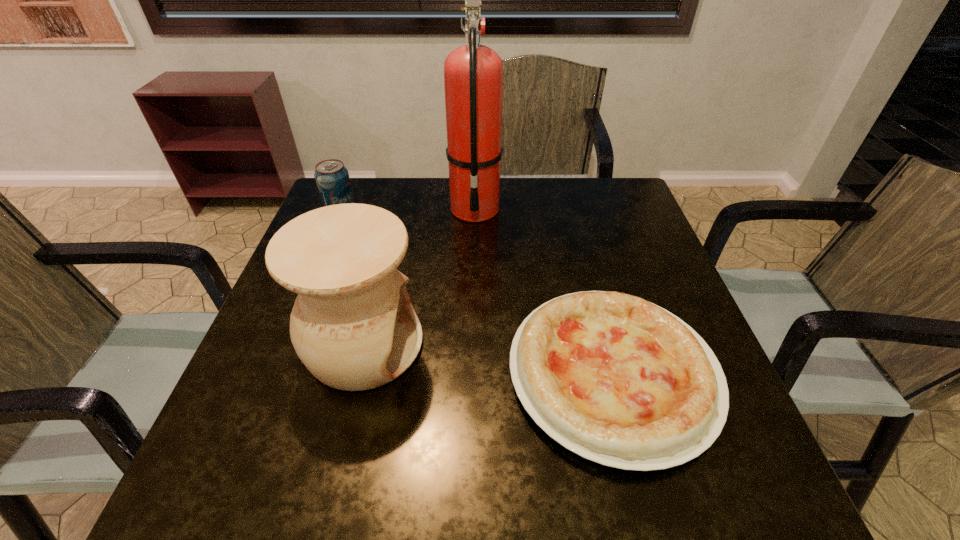
Where is `the third closest object to the second shortest object`? The image size is (960, 540). the third closest object to the second shortest object is located at coordinates 618,380.

The height and width of the screenshot is (540, 960). In order to click on free spot that satisfies the following two spatial constraints: 1. at the open side of the pizza; 2. on the left side of the pottery in this screenshot , I will do `click(356, 374)`.

The image size is (960, 540). In order to click on vacant position in the image that satisfies the following two spatial constraints: 1. at the open side of the shortest object; 2. on the right side of the second tallest object in this screenshot , I will do `click(356, 374)`.

The image size is (960, 540). In order to click on vacant space that satisfies the following two spatial constraints: 1. on the hose direction of the tallest object; 2. on the left side of the pizza in this screenshot , I will do `click(472, 374)`.